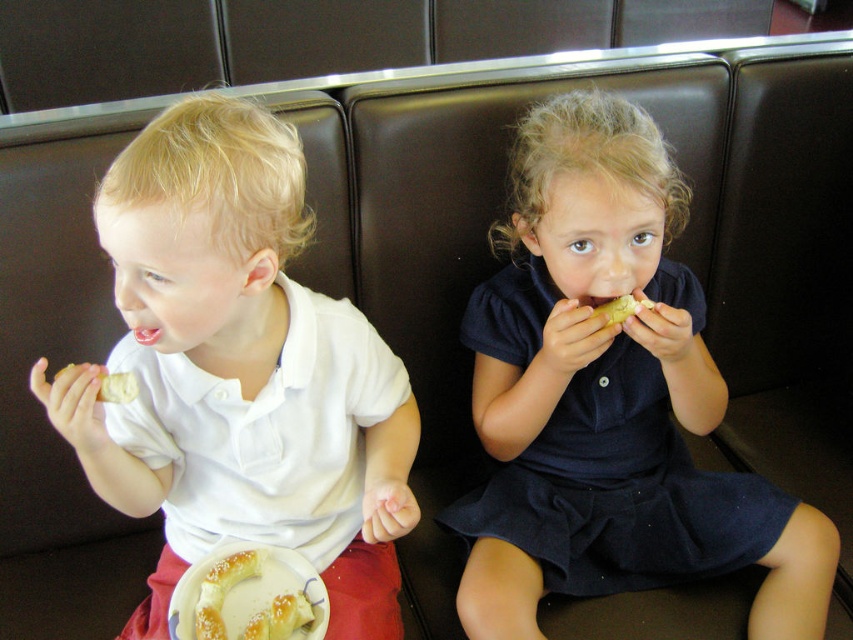
Question: Which of these objects is positioned farthest from the white crumbly pastry at upper left?

Choices:
 (A) dark blue dress at center
 (B) golden brown pastry at lower left
 (C) white matte shirt at left

Answer: (A)

Question: Which object is closer to the camera taking this photo?

Choices:
 (A) yellow matte pastry at upper center
 (B) golden brown pastry at lower left

Answer: (B)

Question: Is the position of white matte shirt at left more distant than that of yellow matte pastry at upper center?

Choices:
 (A) no
 (B) yes

Answer: (A)

Question: Which point is farther to the camera?

Choices:
 (A) white matte shirt at left
 (B) golden brown pastry at lower left

Answer: (B)

Question: Does white matte shirt at left lie in front of white crumbly pastry at upper left?

Choices:
 (A) no
 (B) yes

Answer: (B)

Question: Does white matte shirt at left have a lesser width compared to golden brown pastry at lower left?

Choices:
 (A) yes
 (B) no

Answer: (B)